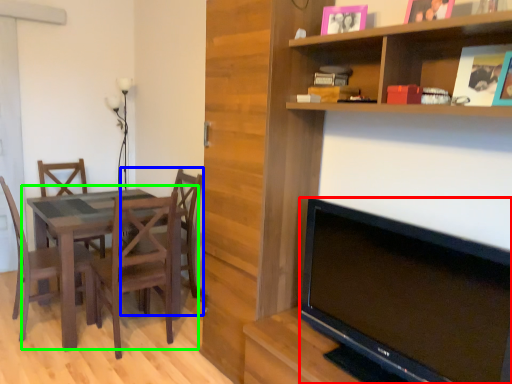
Question: Which object is the closest to the television (highlighted by a red box)? Choose among these: chair (highlighted by a blue box) or kitchen & dining room table (highlighted by a green box).

Choices:
 (A) chair
 (B) kitchen & dining room table

Answer: (B)